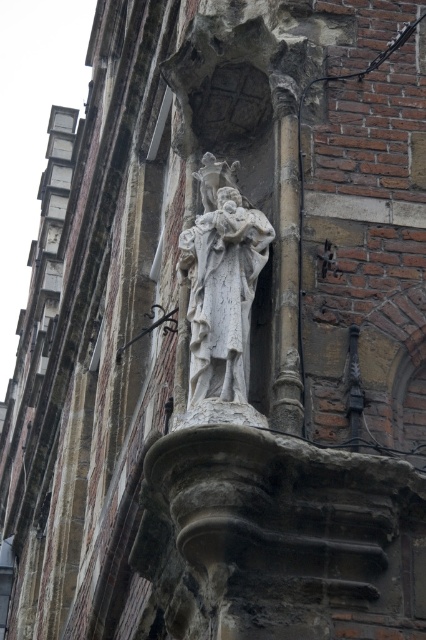
You are an art conservator assessing the space between the white stone statue at center and the polished dark wood crucifix at center for preservation purposes. Which object is smaller in size?

The white stone statue at center is smaller in size compared to the polished dark wood crucifix at center.

You are an architect inspecting the old brick building. You notice the stone column at center and the polished dark wood crucifix at center. Which object is positioned closer to the front of the structure?

The stone column at center is closer to the viewer than the polished dark wood crucifix at center, so the stone column at center is positioned closer to the front of the structure.